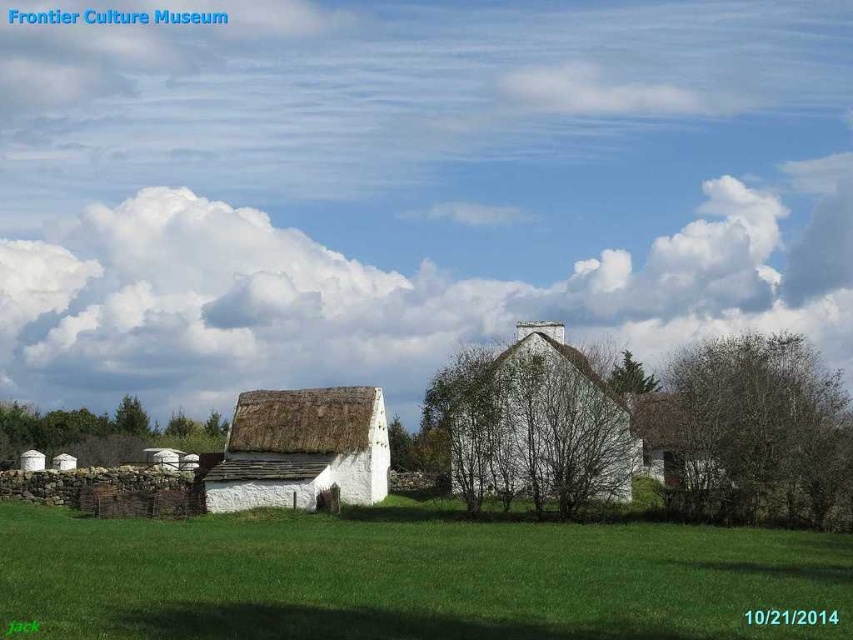
You are a visitor at the Frontier Culture Museum and want to take a photo that includes both the white thatched roof hut at center and the white thatched roof cottage at center. Given that your camera can capture a maximum distance of 15 meters between objects in focus, will you be able to capture both structures clearly in the same photo?

The distance between the white thatched roof hut at center and the white thatched roof cottage at center is 12.98 meters, which is within the camera maximum focus distance of 15 meters. Therefore, both structures can be captured clearly in the same photo.

You are standing at the point marked by the coordinates point [543,426] in the image. Based on the scene description, what structure are you currently positioned at?

The point [543,426] corresponds to the white thatched roof hut at center, so you are positioned at the white thatched roof hut at center.